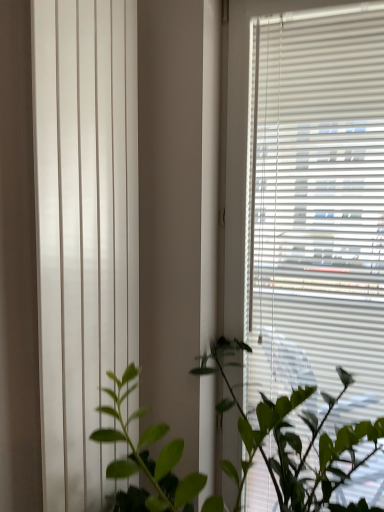
Question: Could you tell me if green leafy plant at center is turned towards white matte blinds at right?

Choices:
 (A) no
 (B) yes

Answer: (A)

Question: Does green leafy plant at center have a lesser width compared to white matte blinds at right?

Choices:
 (A) yes
 (B) no

Answer: (B)

Question: From a real-world perspective, is green leafy plant at center on white matte blinds at right?

Choices:
 (A) yes
 (B) no

Answer: (B)

Question: Is green leafy plant at center in front of white matte blinds at right?

Choices:
 (A) yes
 (B) no

Answer: (A)

Question: Can you confirm if green leafy plant at center is positioned to the left of white matte blinds at right?

Choices:
 (A) yes
 (B) no

Answer: (A)

Question: Can you confirm if green leafy plant at center is positioned to the right of white matte blinds at right?

Choices:
 (A) yes
 (B) no

Answer: (B)

Question: Is white smooth vertical blinds at left positioned with its back to green leafy plant at center?

Choices:
 (A) yes
 (B) no

Answer: (B)

Question: Are white smooth vertical blinds at left and green leafy plant at center beside each other?

Choices:
 (A) no
 (B) yes

Answer: (A)

Question: Can you confirm if white smooth vertical blinds at left is taller than green leafy plant at center?

Choices:
 (A) no
 (B) yes

Answer: (B)

Question: Can green leafy plant at center be found inside white smooth vertical blinds at left?

Choices:
 (A) no
 (B) yes

Answer: (A)

Question: Could you tell me if white smooth vertical blinds at left is turned towards green leafy plant at center?

Choices:
 (A) no
 (B) yes

Answer: (B)

Question: Can you confirm if white smooth vertical blinds at left is wider than green leafy plant at center?

Choices:
 (A) no
 (B) yes

Answer: (A)

Question: Could you tell me if white matte blinds at right is turned towards white smooth vertical blinds at left?

Choices:
 (A) yes
 (B) no

Answer: (B)